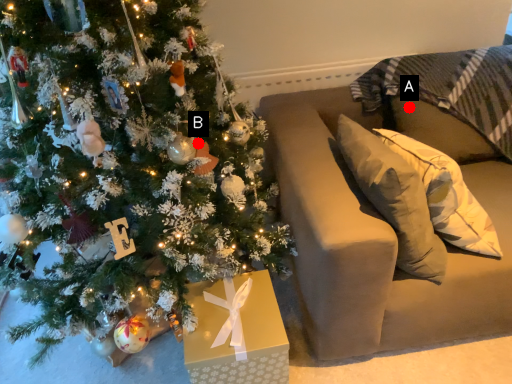
Question: Two points are circled on the image, labeled by A and B beside each circle. Which point is farther to the camera?

Choices:
 (A) A is further
 (B) B is further

Answer: (A)